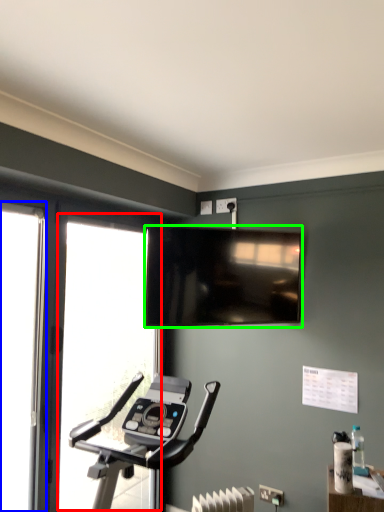
Question: Which is farther away from window (highlighted by a red box)? screen door (highlighted by a blue box) or television (highlighted by a green box)?

Choices:
 (A) screen door
 (B) television

Answer: (B)